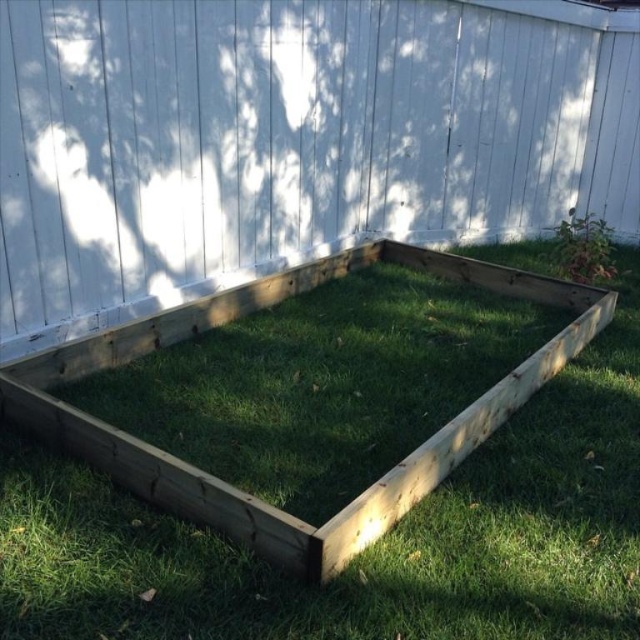
Who is more distant from viewer, (600, 186) or (310, 336)?

Positioned behind is point (600, 186).

What do you see at coordinates (291, 140) in the screenshot?
I see `natural wood fence at center` at bounding box center [291, 140].

This screenshot has height=640, width=640. What do you see at coordinates (291, 140) in the screenshot?
I see `natural wood fence at center` at bounding box center [291, 140].

Where is `natural wood fence at center`? The height and width of the screenshot is (640, 640). natural wood fence at center is located at coordinates (291, 140).